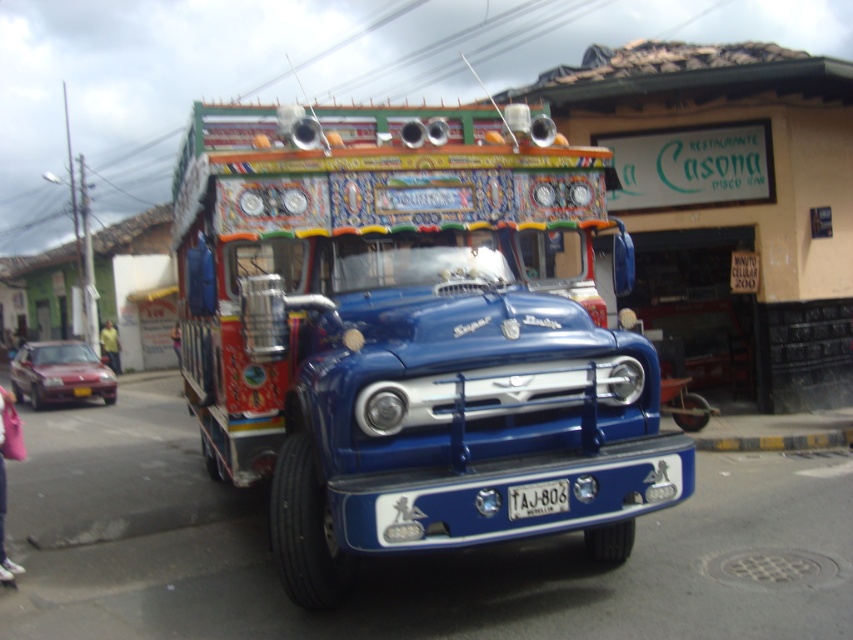
Question: Is yellow concrete curb at lower center above white plastic license plate at center?

Choices:
 (A) no
 (B) yes

Answer: (A)

Question: Which point is closer to the camera?

Choices:
 (A) (728, 440)
 (B) (357, 376)
 (C) (537, 483)

Answer: (B)

Question: Can you confirm if yellow concrete curb at lower center is smaller than white plastic license plate at center?

Choices:
 (A) no
 (B) yes

Answer: (A)

Question: Among these points, which one is farthest from the camera?

Choices:
 (A) click(511, 508)
 (B) click(746, 448)
 (C) click(561, 339)

Answer: (B)

Question: Which point is farther to the camera?

Choices:
 (A) (526, 509)
 (B) (570, 433)

Answer: (B)

Question: Can you confirm if shiny blue truck at center is thinner than white plastic license plate at center?

Choices:
 (A) no
 (B) yes

Answer: (A)